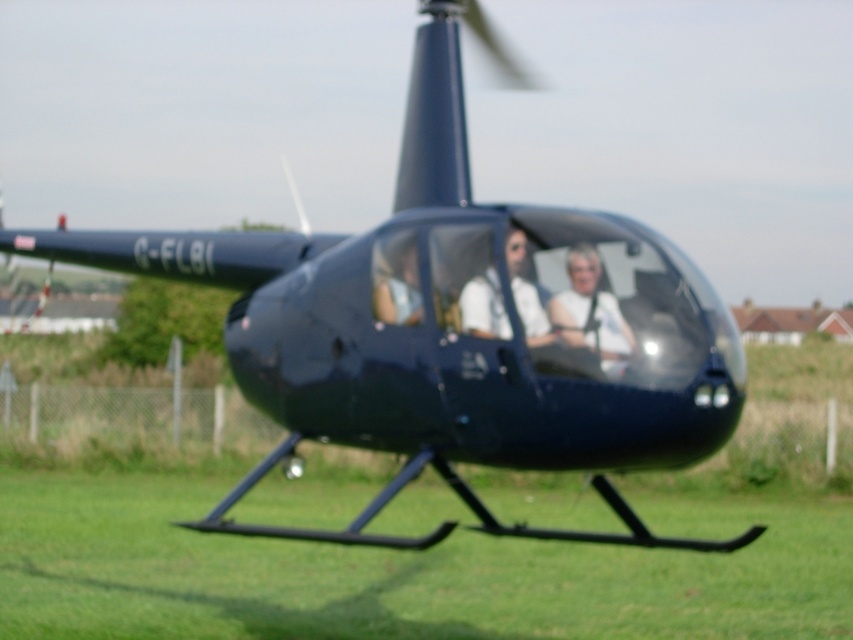
Question: Is white glossy shirt at center smaller than matte white shirt at center?

Choices:
 (A) yes
 (B) no

Answer: (A)

Question: Which point is closer to the camera?

Choices:
 (A) green grass at lower center
 (B) white matte shirt at center
 (C) white glossy shirt at center

Answer: (B)

Question: Estimate the real-world distances between objects in this image. Which object is farther from the green grass at lower center?

Choices:
 (A) matte white shirt at center
 (B) white glossy shirt at center
 (C) white matte shirt at center

Answer: (C)

Question: Among these points, which one is nearest to the camera?

Choices:
 (A) (328, 483)
 (B) (477, 285)
 (C) (444, 323)

Answer: (B)

Question: Considering the relative positions of green grass at lower center and white matte shirt at center in the image provided, where is green grass at lower center located with respect to white matte shirt at center?

Choices:
 (A) above
 (B) below

Answer: (B)

Question: Is white matte shirt at center thinner than matte white shirt at center?

Choices:
 (A) no
 (B) yes

Answer: (B)